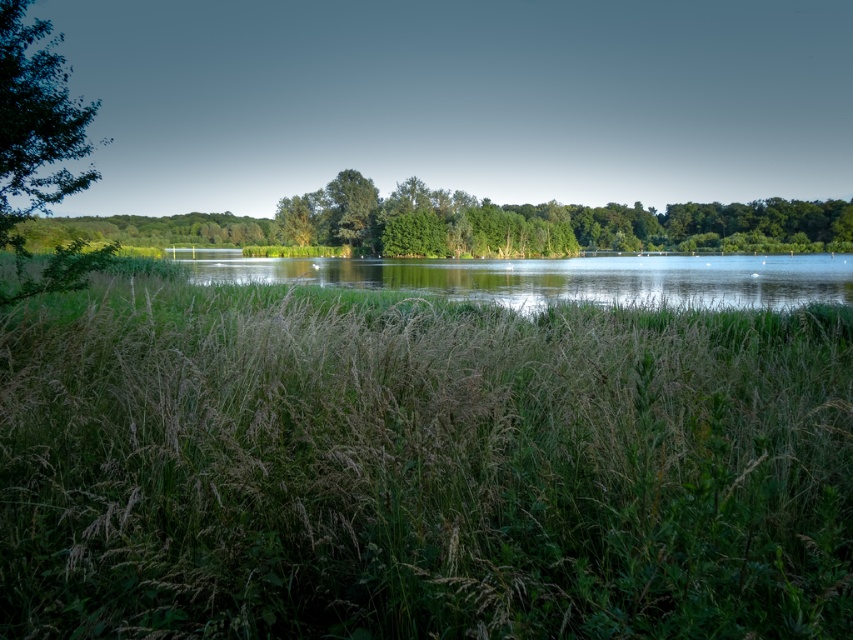
Question: Which point appears farthest from the camera in this image?

Choices:
 (A) (77, 116)
 (B) (86, 468)
 (C) (672, 243)

Answer: (C)

Question: Where is clear water at center located in relation to green leafy tree at left in the image?

Choices:
 (A) above
 (B) below

Answer: (A)

Question: Can you confirm if green grass at center is smaller than clear water at center?

Choices:
 (A) no
 (B) yes

Answer: (B)

Question: Does green grass at center have a smaller size compared to green leafy tree at left?

Choices:
 (A) no
 (B) yes

Answer: (A)

Question: Which object appears closest to the camera in this image?

Choices:
 (A) green grass at center
 (B) green leafy tree at left

Answer: (A)

Question: Which object is closer to the camera taking this photo?

Choices:
 (A) green leafy tree at left
 (B) clear water at center
 (C) green grass at center
 (D) green leafy tree at center

Answer: (C)